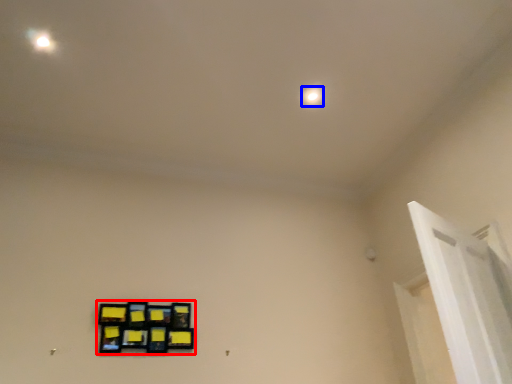
Question: Which point is further to the camera, picture frame (highlighted by a red box) or dot (highlighted by a blue box)?

Choices:
 (A) picture frame
 (B) dot

Answer: (B)